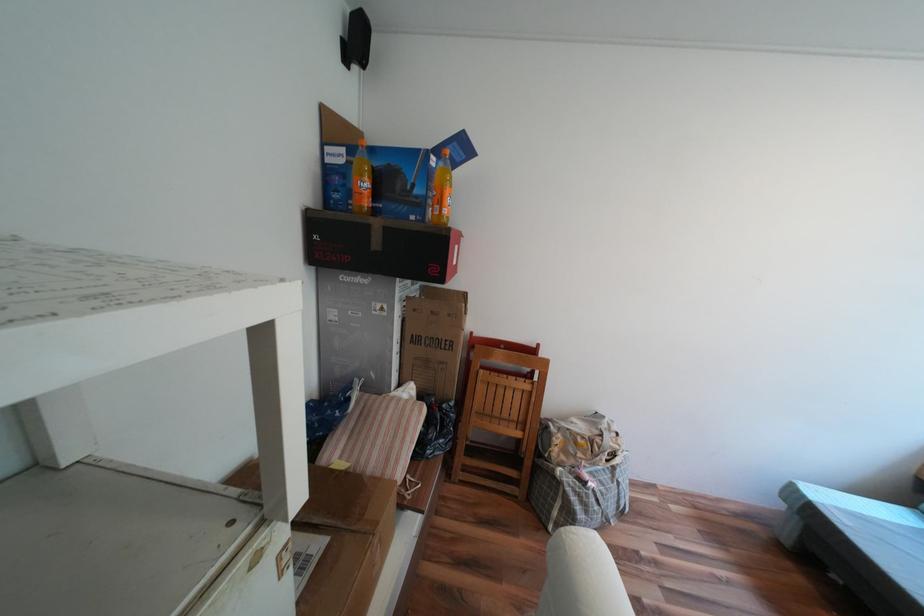
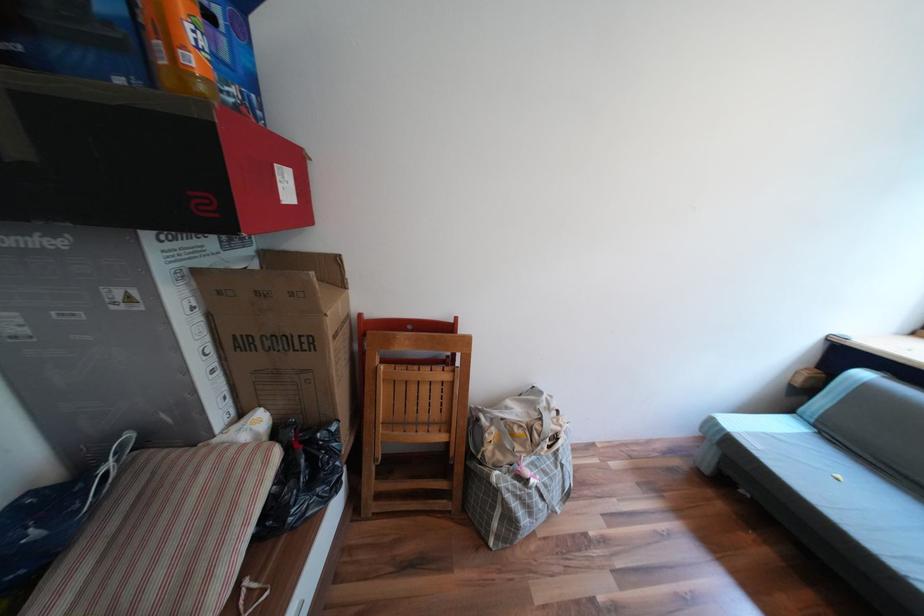
Question: The camera is either moving clockwise (left) or counter-clockwise (right) around the object. The first image is from the beginning of the video and the second image is from the end. Is the camera moving left or right when shooting the video?

Choices:
 (A) Left
 (B) Right

Answer: (A)